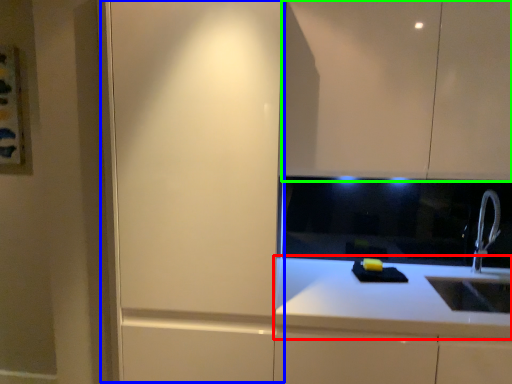
Question: Considering the real-world distances, which object is closest to countertop (highlighted by a red box)? screen door (highlighted by a blue box) or cabinetry (highlighted by a green box).

Choices:
 (A) screen door
 (B) cabinetry

Answer: (A)